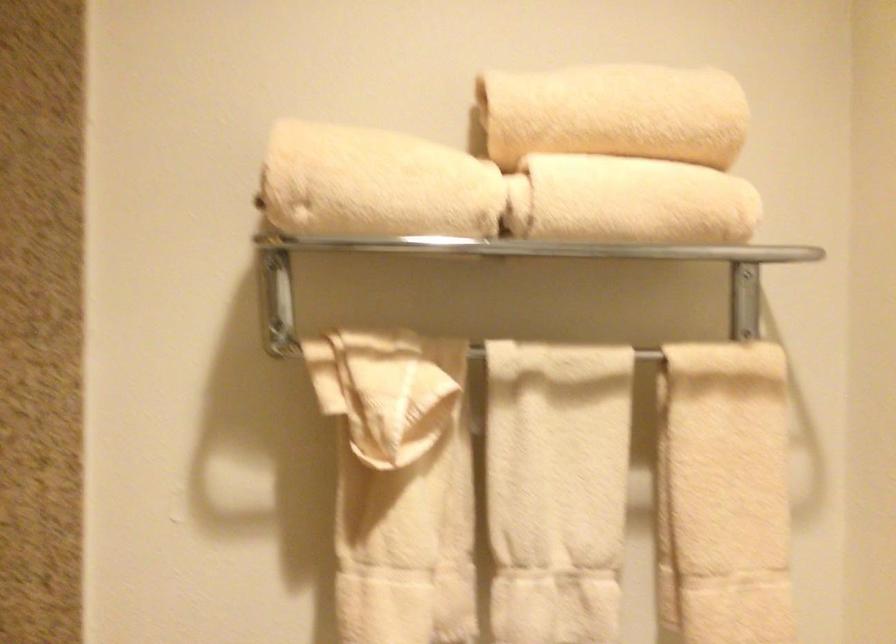
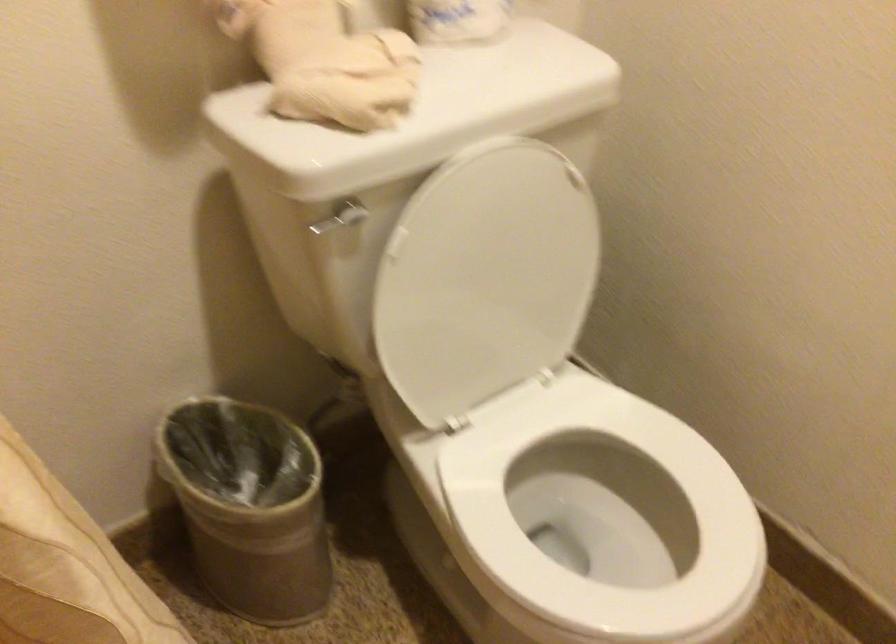
The first image is from the beginning of the video and the second image is from the end. How did the camera likely rotate when shooting the video?

The rotation direction of the camera is right-down.